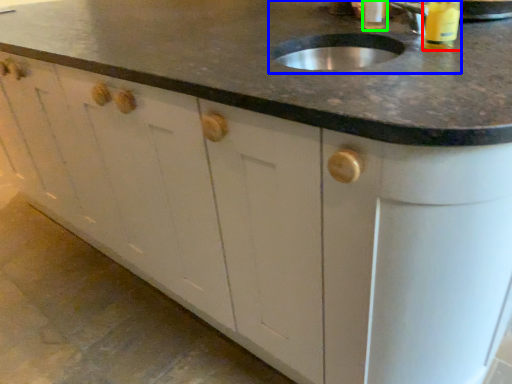
Question: Considering the real-world distances, which object is farthest from beverage (highlighted by a red box)? sink (highlighted by a blue box) or beverage (highlighted by a green box)?

Choices:
 (A) sink
 (B) beverage

Answer: (B)